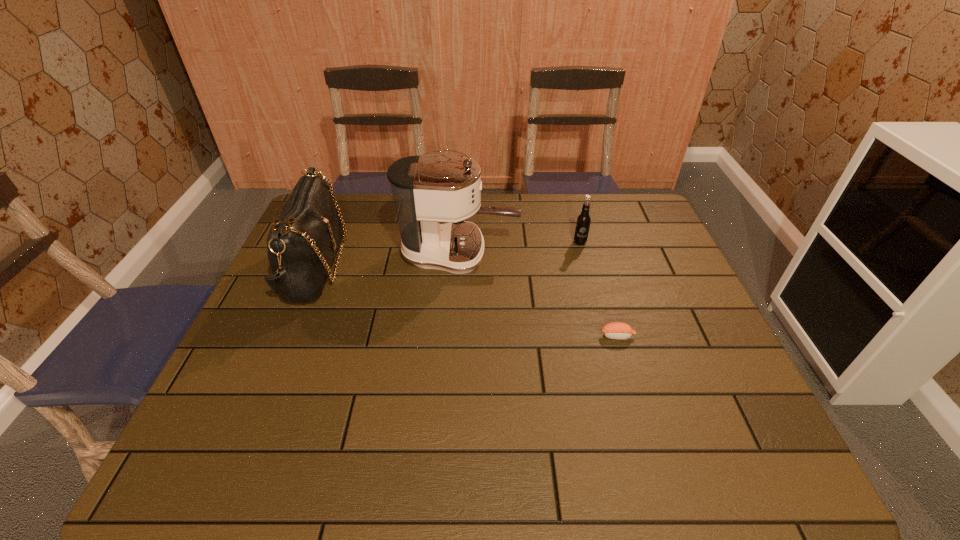
In order to click on blank area in the image that satisfies the following two spatial constraints: 1. on the label of the second shortest object; 2. at the front of the handbag with chain and zipper in this screenshot , I will do `click(587, 267)`.

Find the location of a particular element. The height and width of the screenshot is (540, 960). vacant region that satisfies the following two spatial constraints: 1. on the label of the second shortest object; 2. at the front of the leftmost object with chain and zipper is located at coordinates (587, 267).